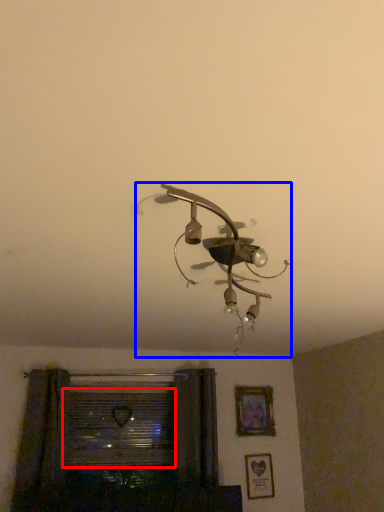
Question: Which of the following is the farthest to the observer, window (highlighted by a red box) or lamp (highlighted by a blue box)?

Choices:
 (A) window
 (B) lamp

Answer: (A)